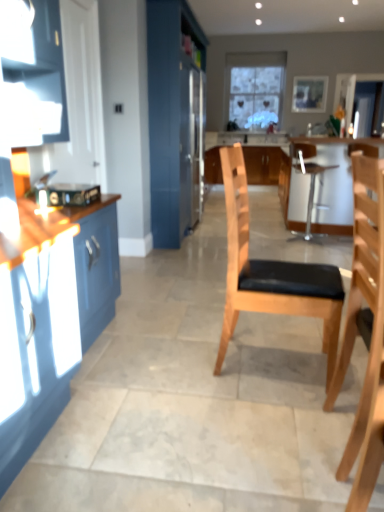
Question: Is wooden picture frame at upper center smaller than satin silver refrigerator at center?

Choices:
 (A) no
 (B) yes

Answer: (B)

Question: Could you tell me if wooden picture frame at upper center is turned towards satin silver refrigerator at center?

Choices:
 (A) yes
 (B) no

Answer: (A)

Question: Does wooden picture frame at upper center come behind satin silver refrigerator at center?

Choices:
 (A) yes
 (B) no

Answer: (A)

Question: Is wooden picture frame at upper center facing away from satin silver refrigerator at center?

Choices:
 (A) no
 (B) yes

Answer: (A)

Question: Is wooden picture frame at upper center at the right side of satin silver refrigerator at center?

Choices:
 (A) no
 (B) yes

Answer: (B)

Question: Considering the relative positions of metallic silver stool at center, acting as the first chair starting from the right, and satin silver refrigerator at center in the image provided, is metallic silver stool at center, acting as the first chair starting from the right, to the left or to the right of satin silver refrigerator at center?

Choices:
 (A) left
 (B) right

Answer: (B)

Question: In terms of width, does metallic silver stool at center, which appears as the third chair when viewed from the left, look wider or thinner when compared to satin silver refrigerator at center?

Choices:
 (A) wide
 (B) thin

Answer: (A)

Question: Looking at the image, does metallic silver stool at center, positioned as the third chair in front-to-back order, seem bigger or smaller compared to satin silver refrigerator at center?

Choices:
 (A) small
 (B) big

Answer: (A)

Question: Would you say metallic silver stool at center, which appears as the third chair when viewed from the left, is inside or outside satin silver refrigerator at center?

Choices:
 (A) outside
 (B) inside

Answer: (A)

Question: In terms of height, does metallic silver toaster at left look taller or shorter compared to light brown wooden chair at center?

Choices:
 (A) tall
 (B) short

Answer: (B)

Question: Do you think metallic silver toaster at left is within light brown wooden chair at center, or outside of it?

Choices:
 (A) outside
 (B) inside

Answer: (A)

Question: Is metallic silver toaster at left in front of or behind light brown wooden chair at center in the image?

Choices:
 (A) behind
 (B) front

Answer: (B)

Question: Looking at their shapes, would you say metallic silver toaster at left is wider or thinner than light brown wooden chair at center?

Choices:
 (A) thin
 (B) wide

Answer: (A)

Question: Is light wood/black cushioned chair at center, the 3th chair from the right, taller or shorter than metallic silver stool at center, which appears as the third chair when viewed from the left?

Choices:
 (A) short
 (B) tall

Answer: (B)

Question: Looking at the image, does light wood/black cushioned chair at center, the 3th chair from the right, seem bigger or smaller compared to metallic silver stool at center, acting as the first chair starting from the right?

Choices:
 (A) big
 (B) small

Answer: (B)